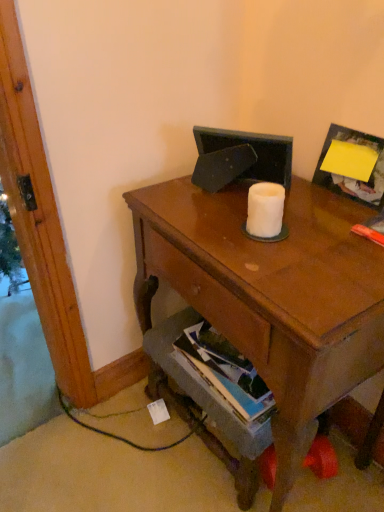
Question: Considering their positions, is white matte toilet paper at center located in front of or behind hardcover book at lower center?

Choices:
 (A) behind
 (B) front

Answer: (B)

Question: In the image, is white matte toilet paper at center on the left side or the right side of hardcover book at lower center?

Choices:
 (A) right
 (B) left

Answer: (A)

Question: Which is farther from the matte brown desk at center?

Choices:
 (A) white matte toilet paper at center
 (B) yellow paper at upper right
 (C) hardcover book at lower center

Answer: (B)

Question: Based on their relative distances, which object is farther from the matte brown desk at center?

Choices:
 (A) hardcover book at lower center
 (B) white matte toilet paper at center
 (C) yellow paper at upper right

Answer: (C)